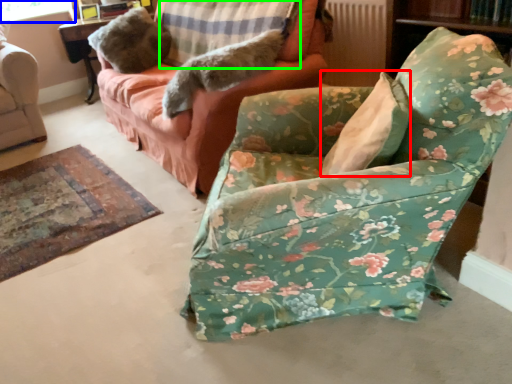
Question: Which object is positioned closest to pillow (highlighted by a red box)? Select from window screen (highlighted by a blue box) and pillow (highlighted by a green box).

Choices:
 (A) window screen
 (B) pillow

Answer: (B)